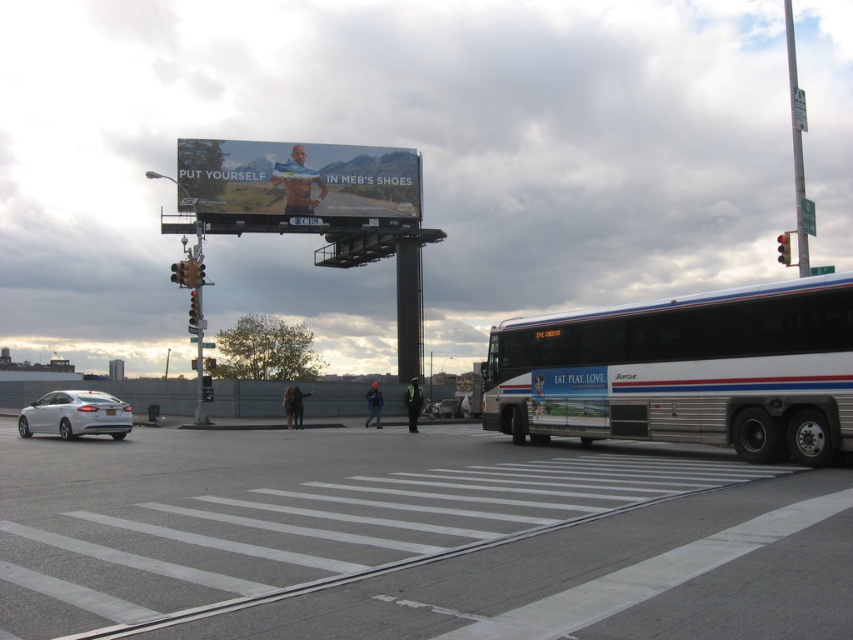
You are a city planner reviewing the street layout. The two traffic lights, red glass traffic light at upper right and metallic yellow traffic light at upper center, are part of a safety assessment. Given that the minimum required distance between traffic lights on the same road is 100 feet, does the current spacing meet the safety standard?

The distance between the red glass traffic light at upper right and the metallic yellow traffic light at upper center is 131.68 feet, which exceeds the minimum required 100 feet, so it meets the safety standard.

From the picture: You are a pedestrian standing at the crosswalk. You want to reach the metallic yellow traffic light at upper center. Can you safely walk straight to it without crossing any roads or obstacles? Explain your reasoning based on the distance between the metallic silver sedan at center and the traffic light.

The metallic silver sedan at center is 11.75 meters away from the metallic yellow traffic light at upper center. Since the sedan is in the middle of the crosswalk and the distance is significant, you would need to cross the road where the sedan is driving, which is unsafe. Therefore, you cannot safely walk straight to the traffic light without crossing the road where the sedan is moving.

You are standing at the crosswalk on the street and see the point marked at coordinates (685, 371). What object is located at that point?

The point at coordinates (685, 371) marks the white metallic bus at center right.